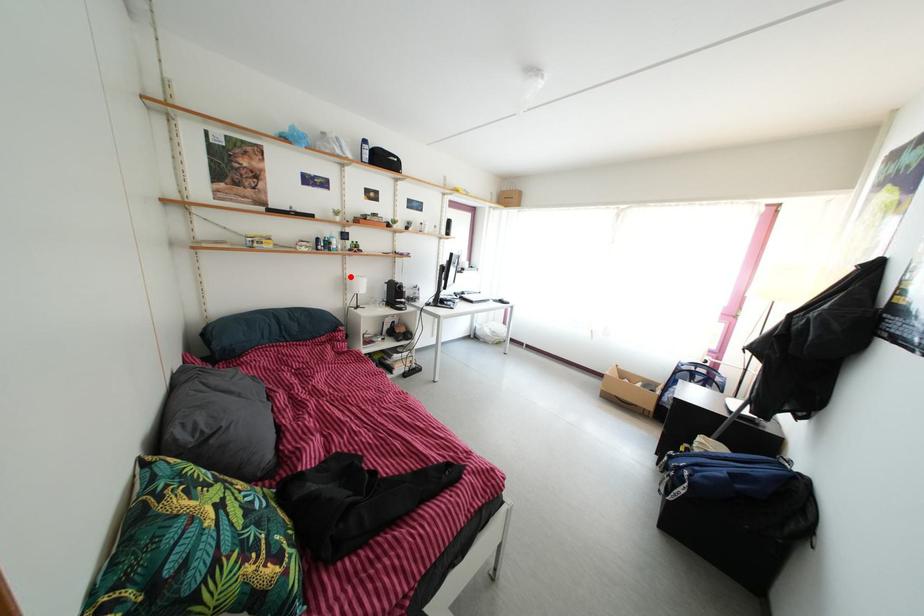
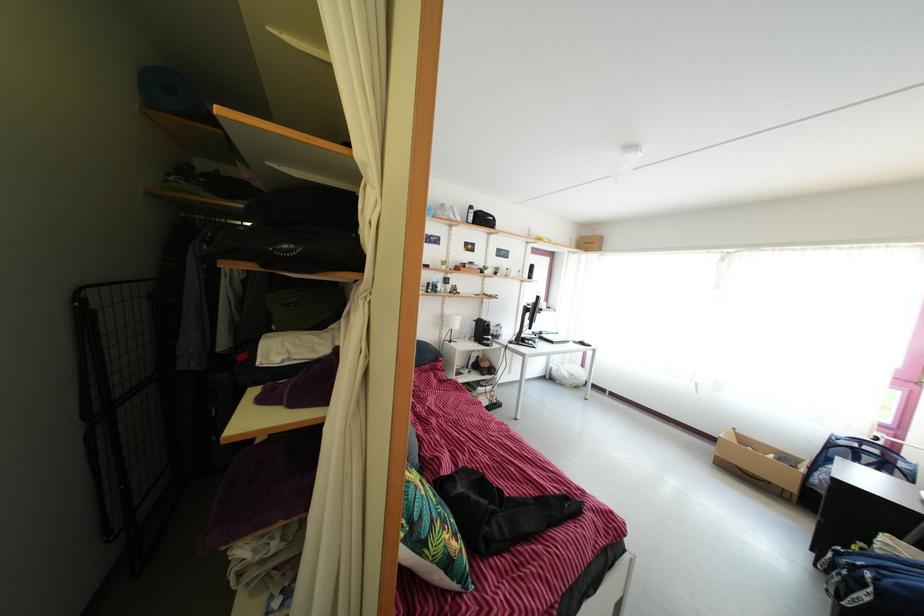
Locate, in the second image, the point that corresponds to the highlighted location in the first image.

(448, 315)